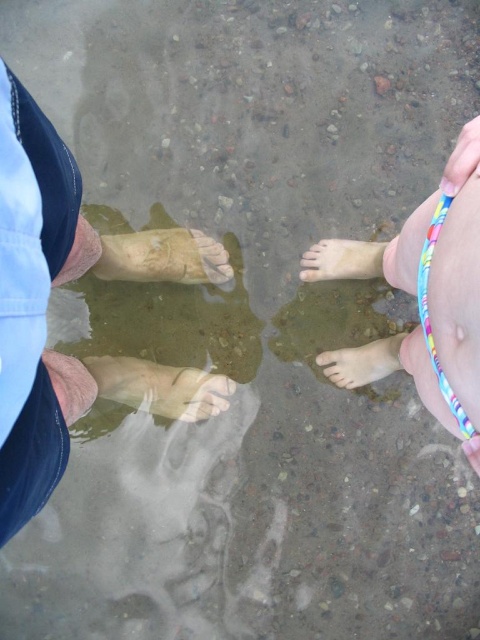
You are a photographer trying to capture the best angle of the scene. You want to ensure both the smooth skin feet at right and the pale skin foot at center are visible in the frame. Based on their positions, which direction should you move your camera to include both subjects?

The smooth skin feet at right are to the right of the pale skin foot at center. To include both in the frame, move the camera to the left so that both the smooth skin feet at right and the pale skin foot at center are captured.

Consider the image. You are a lifeguard observing two people in the water. You notice the smooth plastic toe at upper right and the smooth skin toe at center. Which toe is narrower in width?

The smooth plastic toe at upper right has a lesser width compared to the smooth skin toe at center, so the smooth plastic toe at upper right is narrower.